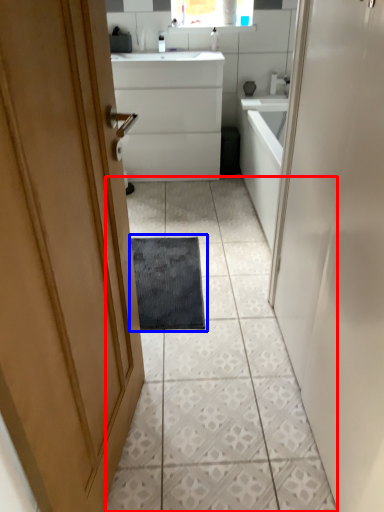
Question: Which point is closer to the camera, ceramic tile (highlighted by a red box) or bath mat (highlighted by a blue box)?

Choices:
 (A) ceramic tile
 (B) bath mat

Answer: (A)